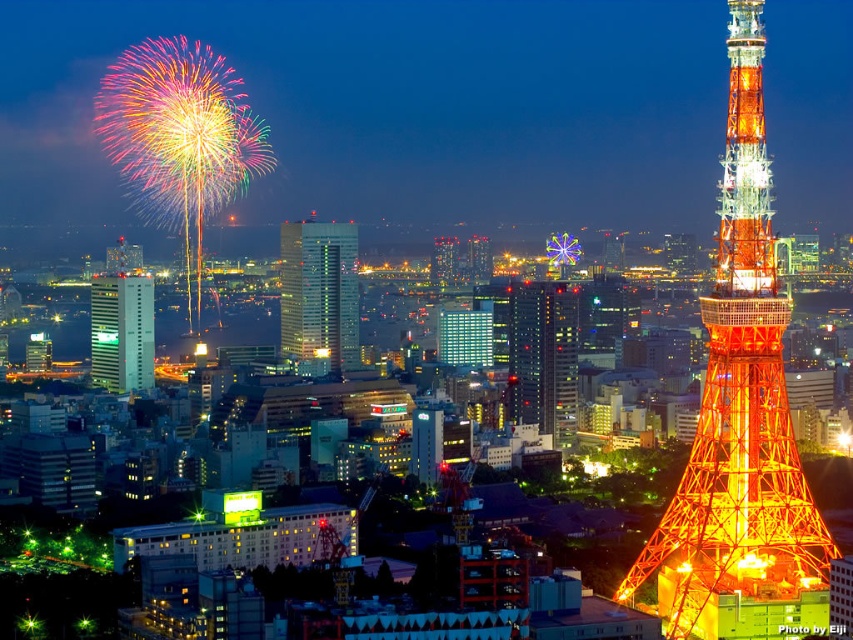
Is green glass skyscraper at center closer to camera compared to green glass building at center?

Yes, it is in front of green glass building at center.

Can you confirm if green glass skyscraper at center is bigger than green glass building at center?

Actually, green glass skyscraper at center might be smaller than green glass building at center.

Who is more distant from viewer, (291,266) or (136,388)?

The point (136,388) is more distant.

This screenshot has height=640, width=853. I want to click on green glass skyscraper at center, so [x=318, y=292].

Does shiny orange tower at right appear on the left side of green glass building at center?

In fact, shiny orange tower at right is to the right of green glass building at center.

Which is more to the right, shiny orange tower at right or green glass building at center?

From the viewer's perspective, shiny orange tower at right appears more on the right side.

Measure the distance between shiny orange tower at right and camera.

shiny orange tower at right and camera are 661.50 meters apart.

Image resolution: width=853 pixels, height=640 pixels. I want to click on shiny orange tower at right, so [x=741, y=419].

Is shiny orange tower at right smaller than shiny glass skyscraper at center?

Incorrect, shiny orange tower at right is not smaller in size than shiny glass skyscraper at center.

Can you confirm if shiny orange tower at right is positioned below shiny glass skyscraper at center?

No.

Which is in front, point (827, 548) or point (546, 316)?

Point (546, 316) is more forward.

The image size is (853, 640). I want to click on shiny orange tower at right, so click(x=741, y=419).